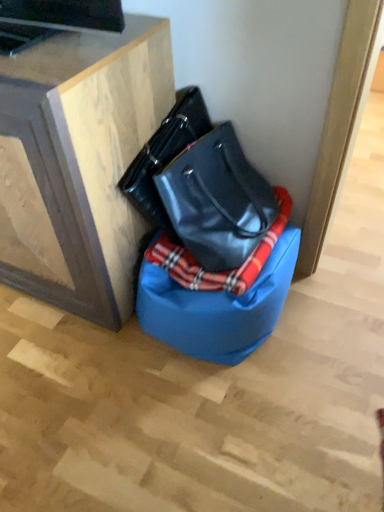
The image size is (384, 512). Identify the location of wooden cabinet at upper left. (79, 163).

From the picture: Is glossy black handbag at center at the back of blue fabric bean bag chair at lower center?

blue fabric bean bag chair at lower center does not have its back to glossy black handbag at center.

Who is smaller, blue fabric bean bag chair at lower center or glossy black handbag at center?

Smaller between the two is glossy black handbag at center.

Does point (161, 302) lie in front of point (136, 204)?

Yes.

At what (x,y) coordinates should I click in order to perform the action: click on blanket on the right of wooden cabinet at upper left. Please return your answer as a coordinate pair (x, y). Image resolution: width=384 pixels, height=512 pixels. Looking at the image, I should click on (223, 271).

Which object is positioned more to the right, wooden cabinet at upper left or plaid fabric blanket at center?

From the viewer's perspective, plaid fabric blanket at center appears more on the right side.

From a real-world perspective, is wooden cabinet at upper left located beneath plaid fabric blanket at center?

No.

Measure the distance from plaid fabric blanket at center to wooden cabinet at upper left.

plaid fabric blanket at center is 12.79 inches away from wooden cabinet at upper left.

Consider the image. Which of these two, plaid fabric blanket at center or wooden cabinet at upper left, is thinner?

plaid fabric blanket at center is thinner.

Is point (196, 289) closer to camera compared to point (49, 111)?

No, it is not.

Is there a large distance between glossy black handbag at center and blue fabric bean bag chair at lower center?

No, glossy black handbag at center is in close proximity to blue fabric bean bag chair at lower center.

At what (x,y) coordinates should I click in order to perform the action: click on handbag in front of the blue fabric bean bag chair at lower center. Please return your answer as a coordinate pair (x, y). Looking at the image, I should click on (165, 157).

From the picture: Considering their positions, is glossy black handbag at center located in front of or behind blue fabric bean bag chair at lower center?

Clearly, glossy black handbag at center is in front of blue fabric bean bag chair at lower center.

Looking at their sizes, would you say glossy black handbag at center is wider or thinner than blue fabric bean bag chair at lower center?

glossy black handbag at center is thinner than blue fabric bean bag chair at lower center.

Is wooden cabinet at upper left next to blue fabric bean bag chair at lower center and touching it?

No, wooden cabinet at upper left is not with blue fabric bean bag chair at lower center.

Can blue fabric bean bag chair at lower center be found inside wooden cabinet at upper left?

No, blue fabric bean bag chair at lower center is not surrounded by wooden cabinet at upper left.

Can you confirm if wooden cabinet at upper left is smaller than blue fabric bean bag chair at lower center?

No.

Is wooden cabinet at upper left closer to the viewer compared to blue fabric bean bag chair at lower center?

Yes, the depth of wooden cabinet at upper left is less than that of blue fabric bean bag chair at lower center.

Considering the positions of objects glossy black handbag at center and wooden cabinet at upper left in the image provided, who is more to the left, glossy black handbag at center or wooden cabinet at upper left?

From the viewer's perspective, wooden cabinet at upper left appears more on the left side.

From the image's perspective, which is below, glossy black handbag at center or wooden cabinet at upper left?

glossy black handbag at center is shown below in the image.

Is glossy black handbag at center spatially inside wooden cabinet at upper left, or outside of it?

glossy black handbag at center is located beyond the bounds of wooden cabinet at upper left.

Considering the sizes of objects glossy black handbag at center and wooden cabinet at upper left in the image provided, who is bigger, glossy black handbag at center or wooden cabinet at upper left?

With larger size is wooden cabinet at upper left.

Is glossy black handbag at center wider or thinner than plaid fabric blanket at center?

Clearly, glossy black handbag at center has less width compared to plaid fabric blanket at center.

How many degrees apart are the facing directions of glossy black handbag at center and plaid fabric blanket at center?

There is a 90-degree angle between the facing directions of glossy black handbag at center and plaid fabric blanket at center.

Which point is more distant from viewer, (x=179, y=128) or (x=280, y=195)?

Point (x=280, y=195)

From the image's perspective, is glossy black handbag at center above or below plaid fabric blanket at center?

From the image's perspective, glossy black handbag at center appears above plaid fabric blanket at center.

Identify the location of handbag above the blue fabric bean bag chair at lower center (from the image's perspective). (165, 157).

Locate an element on the screen. The image size is (384, 512). furniture that appears on the left of plaid fabric blanket at center is located at coordinates (79, 163).

Based on their spatial positions, is wooden cabinet at upper left or plaid fabric blanket at center closer to glossy black handbag at center?

wooden cabinet at upper left.

Based on their spatial positions, is blue fabric bean bag chair at lower center or wooden cabinet at upper left further from plaid fabric blanket at center?

wooden cabinet at upper left is further to plaid fabric blanket at center.

Estimate the real-world distances between objects in this image. Which object is further from wooden cabinet at upper left, glossy black handbag at center or blue fabric bean bag chair at lower center?

blue fabric bean bag chair at lower center.

Estimate the real-world distances between objects in this image. Which object is closer to blue fabric bean bag chair at lower center, glossy black handbag at center or plaid fabric blanket at center?

plaid fabric blanket at center is positioned closer to the anchor blue fabric bean bag chair at lower center.

When comparing their distances from blue fabric bean bag chair at lower center, does plaid fabric blanket at center or glossy black handbag at center seem closer?

plaid fabric blanket at center is closer to blue fabric bean bag chair at lower center.

Considering their positions, is glossy black handbag at center positioned further to plaid fabric blanket at center than blue fabric bean bag chair at lower center?

glossy black handbag at center is further to plaid fabric blanket at center.

Based on their spatial positions, is plaid fabric blanket at center or wooden cabinet at upper left further from blue fabric bean bag chair at lower center?

Among the two, wooden cabinet at upper left is located further to blue fabric bean bag chair at lower center.

Which object lies nearer to the anchor point wooden cabinet at upper left, blue fabric bean bag chair at lower center or glossy black handbag at center?

glossy black handbag at center lies closer to wooden cabinet at upper left than the other object.

Where is `handbag between wooden cabinet at upper left and blue fabric bean bag chair at lower center`? Image resolution: width=384 pixels, height=512 pixels. handbag between wooden cabinet at upper left and blue fabric bean bag chair at lower center is located at coordinates (165, 157).

This screenshot has width=384, height=512. What are the coordinates of `bean bag chair situated between wooden cabinet at upper left and plaid fabric blanket at center from left to right` in the screenshot? It's located at (217, 308).

Where is `blanket between glossy black handbag at center and blue fabric bean bag chair at lower center in the up-down direction`? Image resolution: width=384 pixels, height=512 pixels. blanket between glossy black handbag at center and blue fabric bean bag chair at lower center in the up-down direction is located at coordinates (223, 271).

The width and height of the screenshot is (384, 512). I want to click on handbag between wooden cabinet at upper left and plaid fabric blanket at center from left to right, so click(x=165, y=157).